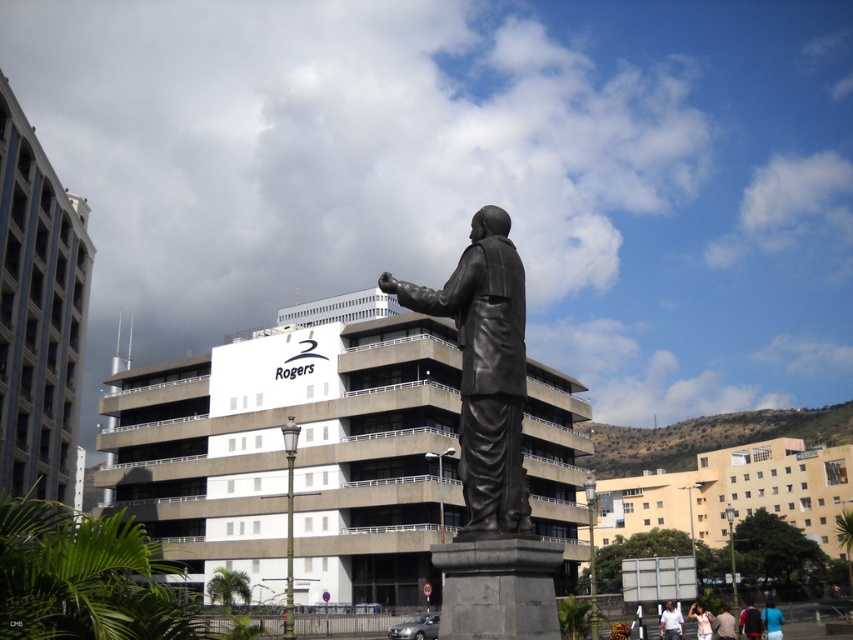
You are a delivery person standing at the statue base. You need to place a package on the light beige shirt at lower right and another on the light brown leather jacket at lower right. Can you leave both packages without moving more than 10 feet from your current position?

The light beige shirt at lower right and light brown leather jacket at lower right are 8.86 feet apart, so yes, you can leave both packages without moving more than 10 feet from your current position since the distance between them is within the 10 feet limit.

You are standing in the urban scene and want to locate the light beige shirt at lower right. Based on the coordinates provided, can you determine its position relative to the statue?

The light beige shirt at lower right is located at coordinates point (701, 620), which places it near the lower right corner of the image, far from the statue.